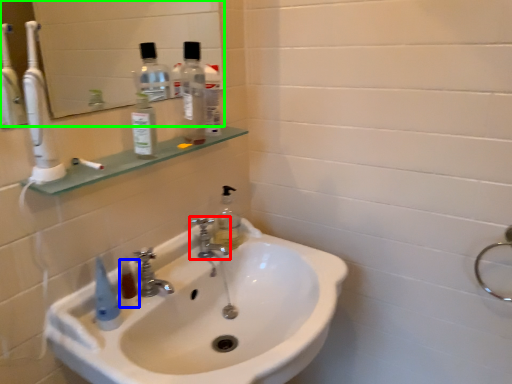
Question: Based on their relative distances, which object is farther from tap (highlighted by a red box)? Choose from mouthwash (highlighted by a blue box) and mirror (highlighted by a green box).

Choices:
 (A) mouthwash
 (B) mirror

Answer: (B)